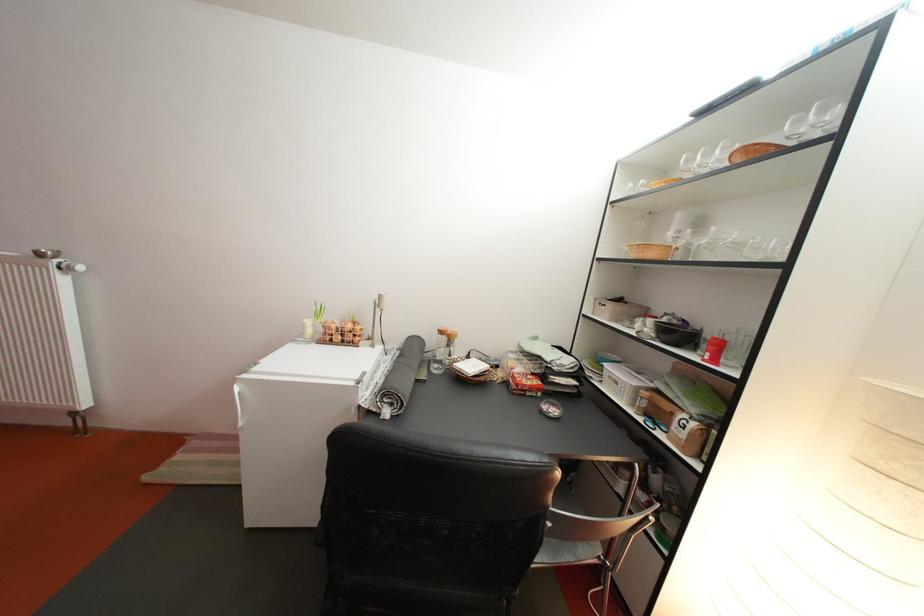
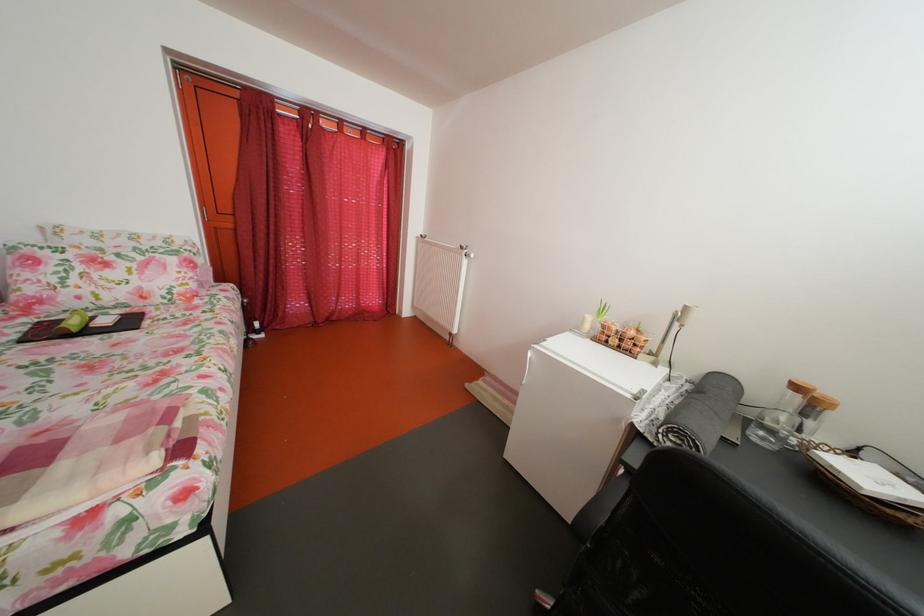
In the second image, find the point that corresponds to the point at 482,374 in the first image.

(880, 485)